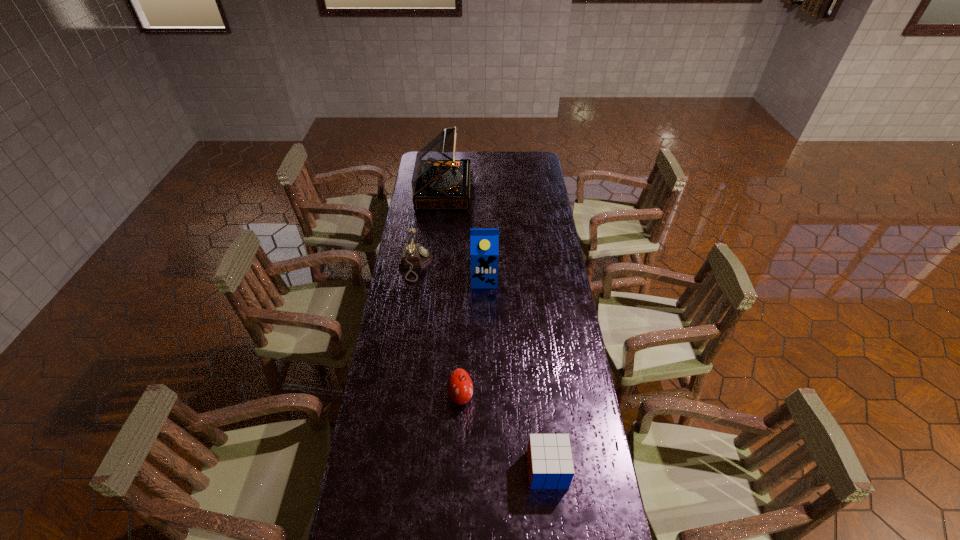
What are the coordinates of `vacant area situated 0.080m on the left of the cube` in the screenshot? It's located at (501, 469).

Find the location of a particular element. The width and height of the screenshot is (960, 540). object that is at the far edge is located at coordinates (439, 181).

Find the location of a particular element. record player present at the left edge is located at coordinates (439, 181).

At what (x,y) coordinates should I click in order to perform the action: click on telephone present at the left edge. Please return your answer as a coordinate pair (x, y). This screenshot has height=540, width=960. Looking at the image, I should click on (414, 255).

This screenshot has width=960, height=540. What are the coordinates of `object positioned at the right edge` in the screenshot? It's located at (550, 466).

You are a GUI agent. You are given a task and a screenshot of the screen. Output one action in this format:
    pyautogui.click(x=<x>, y=<y>)
    Task: Click on the object located at the far left corner
    The height and width of the screenshot is (540, 960).
    Given the screenshot: What is the action you would take?
    pyautogui.click(x=439, y=181)

Image resolution: width=960 pixels, height=540 pixels. I want to click on vacant space at the left edge of the desktop, so click(373, 458).

Where is `vacant space at the right edge of the desktop`? vacant space at the right edge of the desktop is located at coordinates (525, 220).

At what (x,y) coordinates should I click in order to perform the action: click on blank space at the far right corner of the desktop. Please return your answer as a coordinate pair (x, y). Image resolution: width=960 pixels, height=540 pixels. Looking at the image, I should click on (524, 170).

Locate an element on the screen. This screenshot has width=960, height=540. vacant area that lies between the farthest object and the carton is located at coordinates (464, 235).